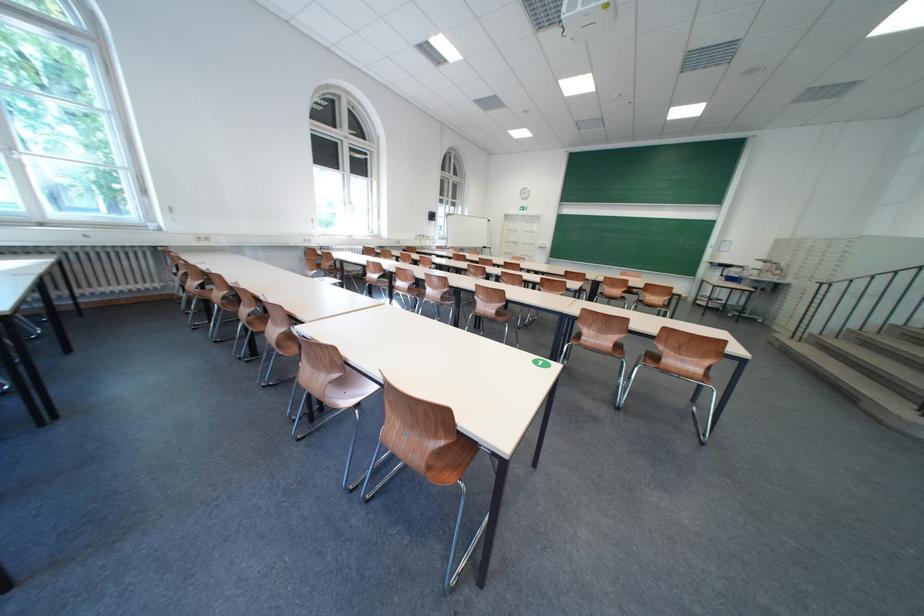
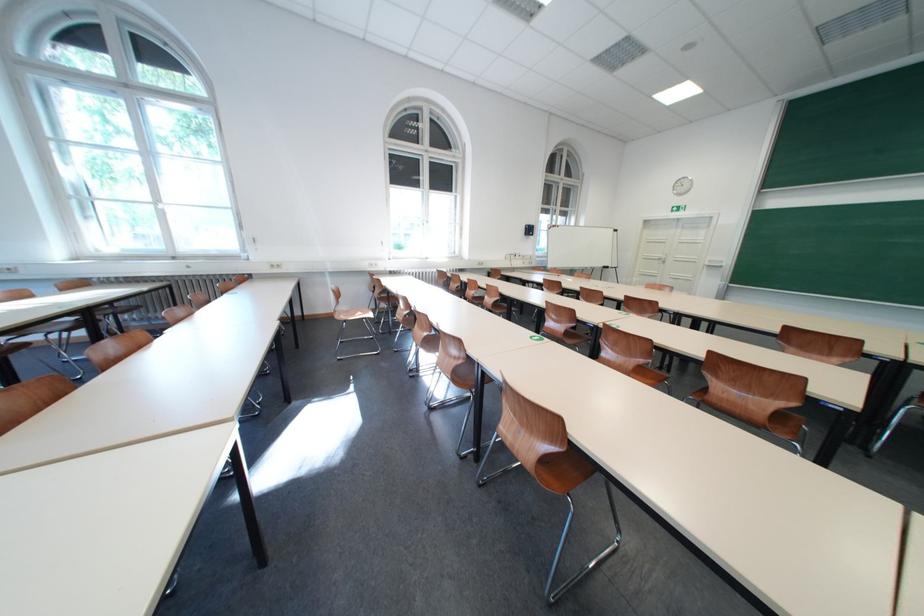
Question: In a continuous first-person perspective shot, in which direction is the camera moving?

Choices:
 (A) Left
 (B) Right
 (C) Forward
 (D) Backward

Answer: (C)